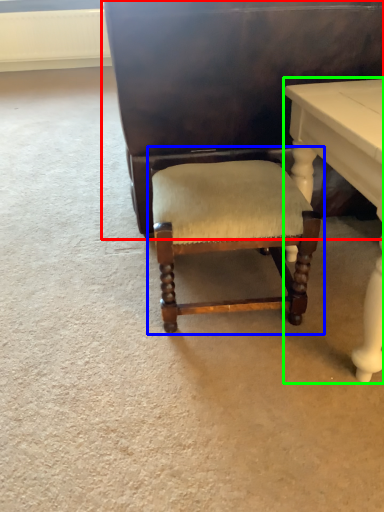
Question: Considering the real-world distances, which object is farthest from vanity (highlighted by a red box)? chair (highlighted by a blue box) or table (highlighted by a green box)?

Choices:
 (A) chair
 (B) table

Answer: (A)